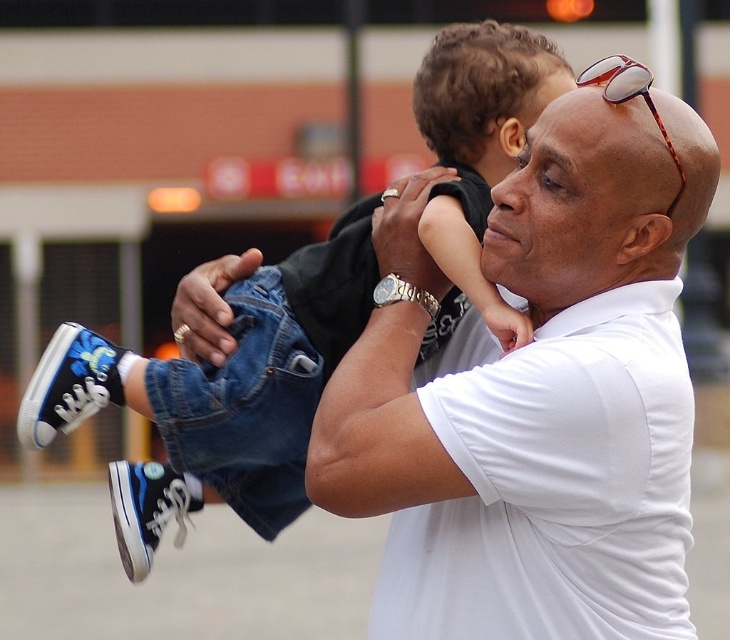
Which is below, white matte shirt at center or blue canvas sneakers at center?

white matte shirt at center

Find the location of a particular element. The width and height of the screenshot is (730, 640). white matte shirt at center is located at coordinates point(534,394).